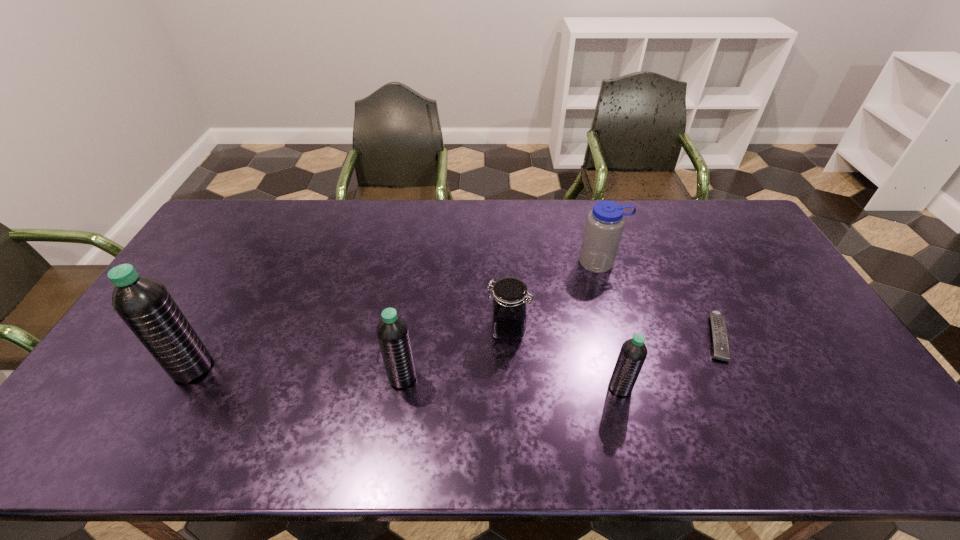
Where is `free space that is in between the leftmost water bottle and the second object from left to right`? free space that is in between the leftmost water bottle and the second object from left to right is located at coordinates (298, 373).

Identify the location of free space that is in between the jar and the second object from left to right. The image size is (960, 540). (455, 353).

The image size is (960, 540). What are the coordinates of `empty location between the leftmost object and the fifth tallest object` in the screenshot? It's located at (349, 348).

At what (x,y) coordinates should I click in order to perform the action: click on empty location between the shortest object and the jar. Please return your answer as a coordinate pair (x, y). Looking at the image, I should click on [612, 333].

Select which object is the fourth closest to the third water bottle from right to left. Please provide its 2D coordinates. Your answer should be formatted as a tuple, i.e. [(x, y)], where the tuple contains the x and y coordinates of a point satisfying the conditions above.

[(605, 223)]

At what (x,y) coordinates should I click in order to perform the action: click on the third closest object to the tallest object. Please return your answer as a coordinate pair (x, y). The height and width of the screenshot is (540, 960). Looking at the image, I should click on (633, 353).

Identify which water bottle is the second nearest to the second water bottle from left to right. Please provide its 2D coordinates. Your answer should be formatted as a tuple, i.e. [(x, y)], where the tuple contains the x and y coordinates of a point satisfying the conditions above.

[(633, 353)]

I want to click on water bottle that is the third closest to the farthest water bottle, so click(x=144, y=304).

Where is `free space that satisfies the following two spatial constraints: 1. with a carrying loop on the side of the farthest water bottle; 2. on the lid of the fourth object from right to left`? free space that satisfies the following two spatial constraints: 1. with a carrying loop on the side of the farthest water bottle; 2. on the lid of the fourth object from right to left is located at coordinates (619, 329).

Where is `free space that satisfies the following two spatial constraints: 1. with a carrying loop on the side of the farthest water bottle; 2. on the lid of the jar`? This screenshot has width=960, height=540. free space that satisfies the following two spatial constraints: 1. with a carrying loop on the side of the farthest water bottle; 2. on the lid of the jar is located at coordinates (619, 329).